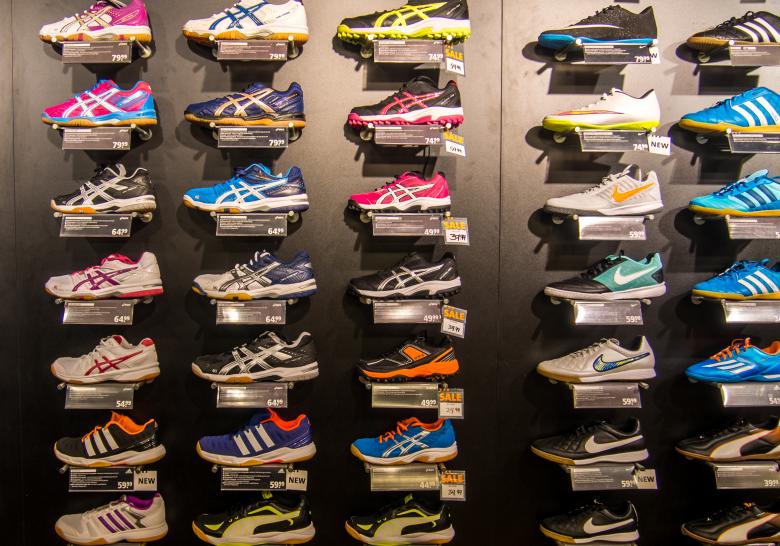
At what (x,y) coordinates should I click in order to perform the action: click on left column of shoes. Please return your answer as a coordinate pair (x, y). The width and height of the screenshot is (780, 546). Looking at the image, I should click on (105, 29), (101, 97), (111, 192), (118, 281), (121, 360), (117, 446), (130, 511).